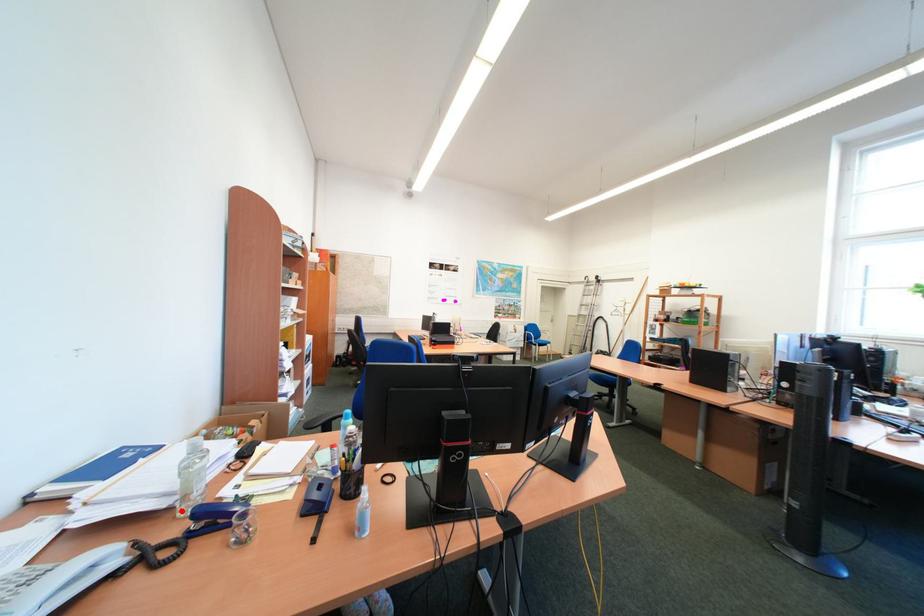
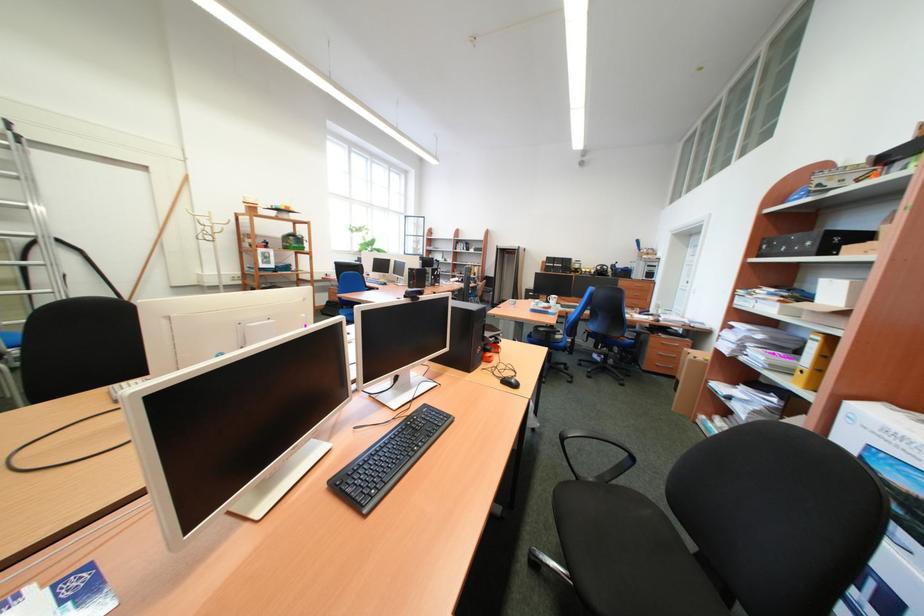
Question: I am providing you with two images of the same scene from different viewpoints. A red point is marked on the first image. Is the red point's position out of view in image 2?

Choices:
 (A) Yes
 (B) No

Answer: (A)